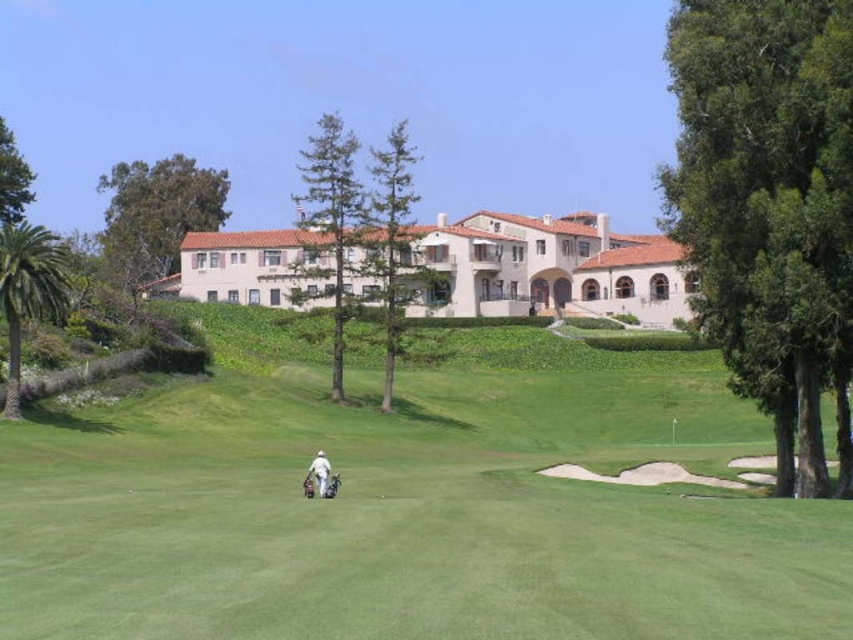
Question: Which point is closer to the camera?

Choices:
 (A) pos(328,477)
 (B) pos(465,518)

Answer: (B)

Question: Among these points, which one is farthest from the camera?

Choices:
 (A) (369, 529)
 (B) (329, 484)

Answer: (B)

Question: Is the position of green grassy golf course at center more distant than that of white fabric golf bag at center?

Choices:
 (A) yes
 (B) no

Answer: (B)

Question: Which point is farther to the camera?

Choices:
 (A) green grassy golf course at center
 (B) white fabric golf bag at center

Answer: (B)

Question: Can you confirm if green grassy golf course at center is smaller than white fabric golf bag at center?

Choices:
 (A) no
 (B) yes

Answer: (A)

Question: Does green grassy golf course at center have a larger size compared to white fabric golf bag at center?

Choices:
 (A) no
 (B) yes

Answer: (B)